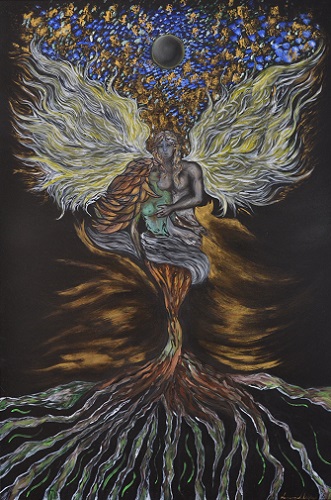
At what (x,y) coordinates should I click in order to perform the action: click on robe. Please return your answer as a coordinate pair (x, y). This screenshot has width=331, height=500. Looking at the image, I should click on (186, 232).